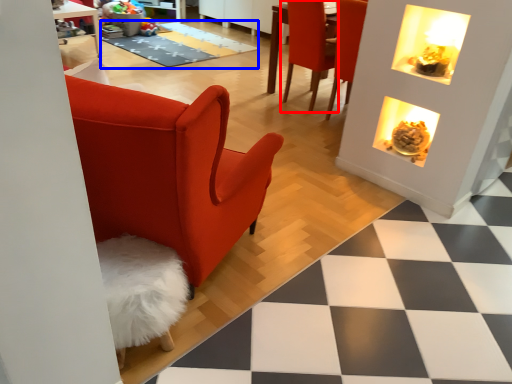
Question: Which point is further to the camera, chair (highlighted by a red box) or mat (highlighted by a blue box)?

Choices:
 (A) chair
 (B) mat

Answer: (B)